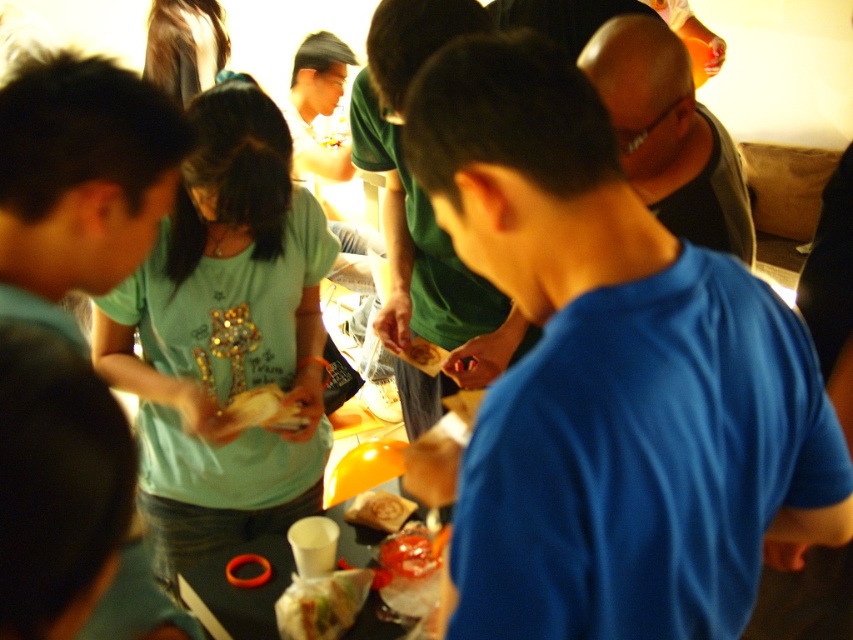
Based on the photo, which of these two, blue smooth shirt at center or smooth plastic snack at center, stands shorter?

With less height is smooth plastic snack at center.

Which is behind, point (525, 452) or point (402, 349)?

Point (402, 349)

What are the coordinates of `blue smooth shirt at center` in the screenshot? It's located at (610, 378).

Based on the photo, who is lower down, white paper bag at center or smooth plastic snack at center?

white paper bag at center

Who is more distant from viewer, (225, 426) or (421, 365)?

Point (421, 365)

The height and width of the screenshot is (640, 853). Find the location of `white paper bag at center`. white paper bag at center is located at coordinates (260, 410).

Looking at this image, can you confirm if blue smooth shirt at center is positioned below white paper bag at center?

Actually, blue smooth shirt at center is above white paper bag at center.

At what (x,y) coordinates should I click in order to perform the action: click on blue smooth shirt at center. Please return your answer as a coordinate pair (x, y). The image size is (853, 640). Looking at the image, I should click on (610, 378).

Who is more distant from viewer, (509, 394) or (282, 416)?

The point (282, 416) is behind.

The image size is (853, 640). Identify the location of blue smooth shirt at center. (610, 378).